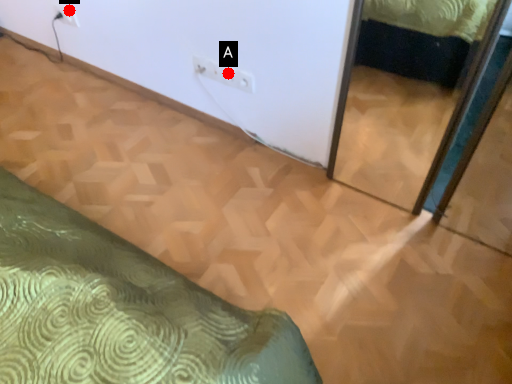
Question: Two points are circled on the image, labeled by A and B beside each circle. Among these points, which one is farthest from the camera?

Choices:
 (A) A is further
 (B) B is further

Answer: (B)